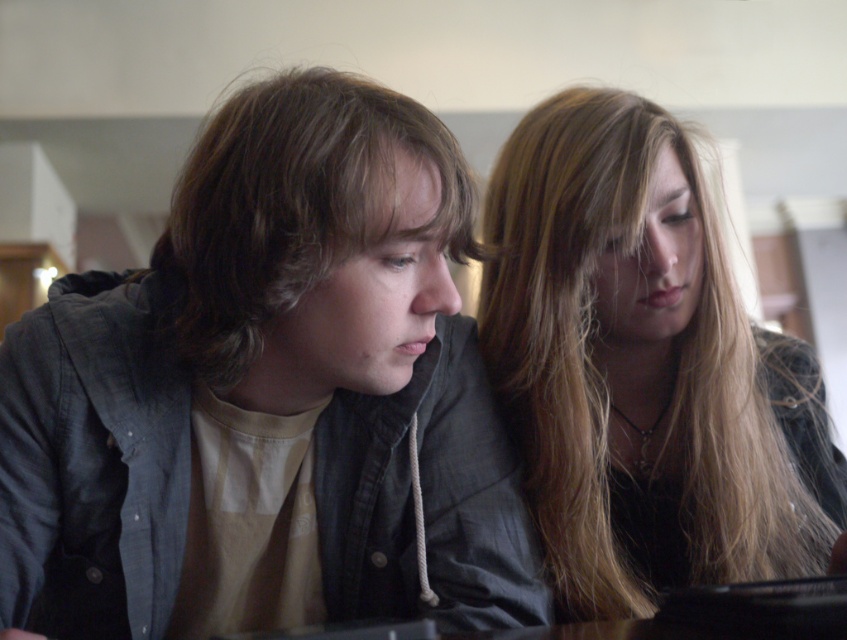
You are a photographer adjusting the lighting for a portrait. You notice two people in the frame with their hair styled differently. The smooth black hair at center and brownhair at center. Which person should you adjust the lighting for to ensure their hair stands out more, based on their hair height?

The smooth black hair at center has a greater height compared to brownhair at center, so adjusting the lighting for the smooth black hair at center would help it stand out more due to its taller height.

You are a photographer adjusting the camera angle to capture both the matte gray jacket at center and the brownhair at center in the frame. Based on their positions, which object should you focus on first to ensure proper depth of field?

The matte gray jacket at center is much taller than brownhair at center, so you should focus on the matte gray jacket at center first to ensure proper depth of field.

You are a photographer who wants to capture a closeup of the smooth black hair at center without including the matte gray jacket at center in the frame. Based on their positions, is this possible?

The matte gray jacket at center is positioned on the left side of smooth black hair at center, so the smooth black hair at center is to the right of the matte gray jacket at center. By framing the shot to exclude the left side of the matte gray jacket at center, the photographer can capture the smooth black hair at center without including it.